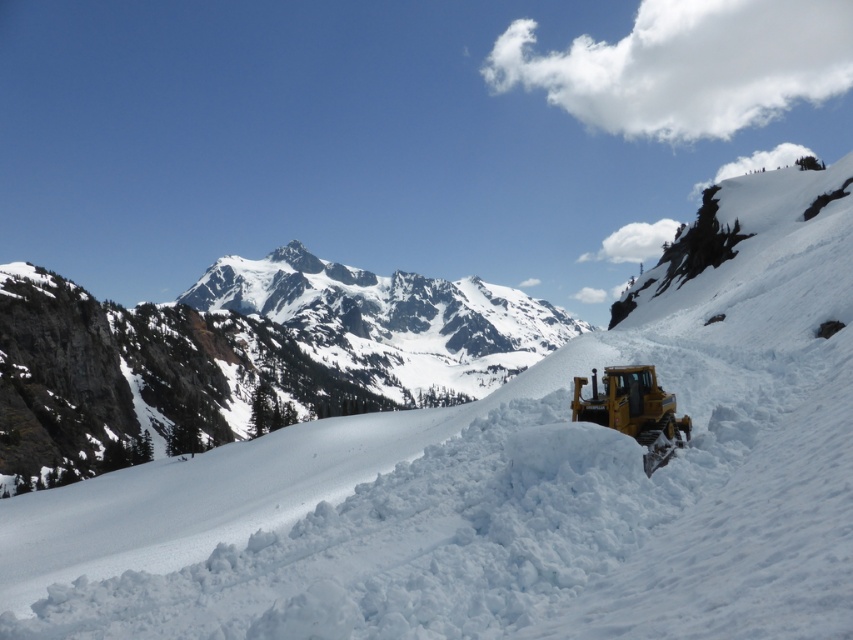
You are standing at the base of the snowy rocky mountain at center and want to reach the summit. The snowplow in the foreground is 10 feet wide. If you were to place the snowplow at the base of the mountain, would it block the entire view of the mountain from your current position?

The snowy rocky mountain at center is 417.21 feet away from the viewer. The snowplow is only 10 feet wide, so placing it at the base would not block the entire view of the mountain since the distance is much greater than the width of the snowplow.